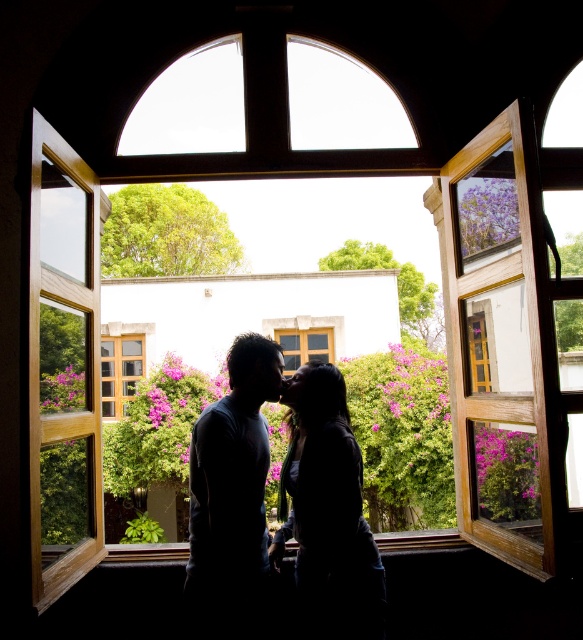
In the scene shown: You are an interior designer planning to hang a large painting on the wall where the wooden frame at left and wooden window at center are located. Since you want the painting to be centered between these two wooden elements, which one should you use as a reference point to ensure symmetry?

The wooden window at center should be used as the reference point because the wooden frame at left is positioned to its right, meaning the window is centrally located between them. By centering the painting around the wooden window at center, symmetry can be achieved.

You are an interior designer assessing the space through the window. The wooden frame at left and the black matte couple at center are both visible in the scene. Which object takes up more area in the image?

The wooden frame at left takes up more area in the image because the black matte couple at center occupies less space than the wooden frame at left according to the description.

You are a painter standing in the room and want to paint the wooden window at center from the wooden frame at left. Given that your painting equipment requires a minimum of 40 feet distance for accuracy, will you be able to paint it accurately from your current position?

The distance between the wooden frame at left and wooden window at center is 39.83 feet, which is less than the required 40 feet. Therefore, you cannot paint the wooden window at center accurately from your current position.